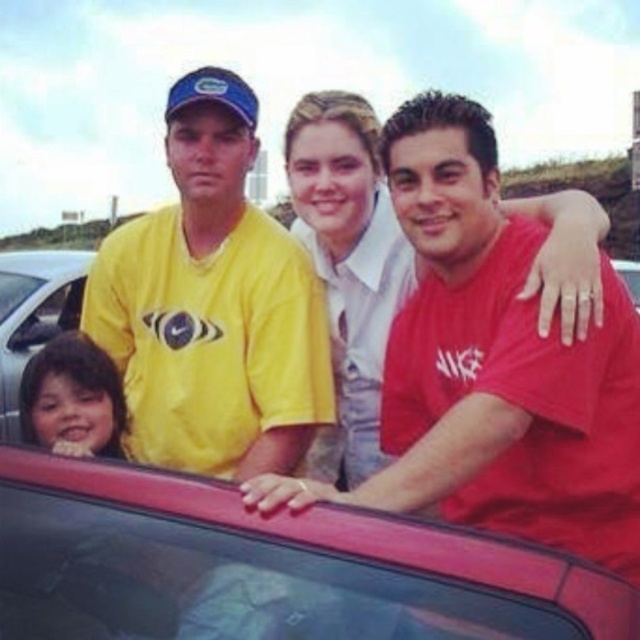
Who is taller, yellow matte t-shirt at center or metallic silver car at lower left?

yellow matte t-shirt at center is taller.

Is yellow matte t-shirt at center bigger than metallic silver car at lower left?

No, yellow matte t-shirt at center is not bigger than metallic silver car at lower left.

The width and height of the screenshot is (640, 640). In order to click on yellow matte t-shirt at center in this screenshot , I will do `click(212, 305)`.

Locate an element on the screen. yellow matte t-shirt at center is located at coordinates (212, 305).

Based on the photo, who is positioned more to the right, transparent glass car window at center or metallic silver car at lower left?

transparent glass car window at center is more to the right.

Between transparent glass car window at center and metallic silver car at lower left, which one is positioned higher?

Positioned higher is metallic silver car at lower left.

What do you see at coordinates (266, 566) in the screenshot?
I see `transparent glass car window at center` at bounding box center [266, 566].

What are the coordinates of `transparent glass car window at center` in the screenshot? It's located at (266, 566).

Between transparent glass car window at center and yellow matte t-shirt at center, which one has less height?

With less height is transparent glass car window at center.

Who is more distant from viewer, (387,524) or (170,120)?

The point (170,120) is more distant.

The image size is (640, 640). What are the coordinates of `transparent glass car window at center` in the screenshot? It's located at (266, 566).